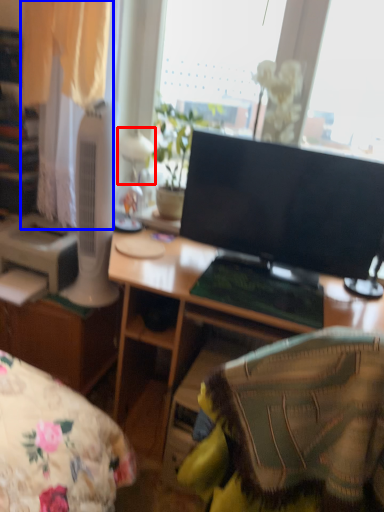
Question: Which object is closer to the camera taking this photo, table lamp (highlighted by a red box) or curtain (highlighted by a blue box)?

Choices:
 (A) table lamp
 (B) curtain

Answer: (B)